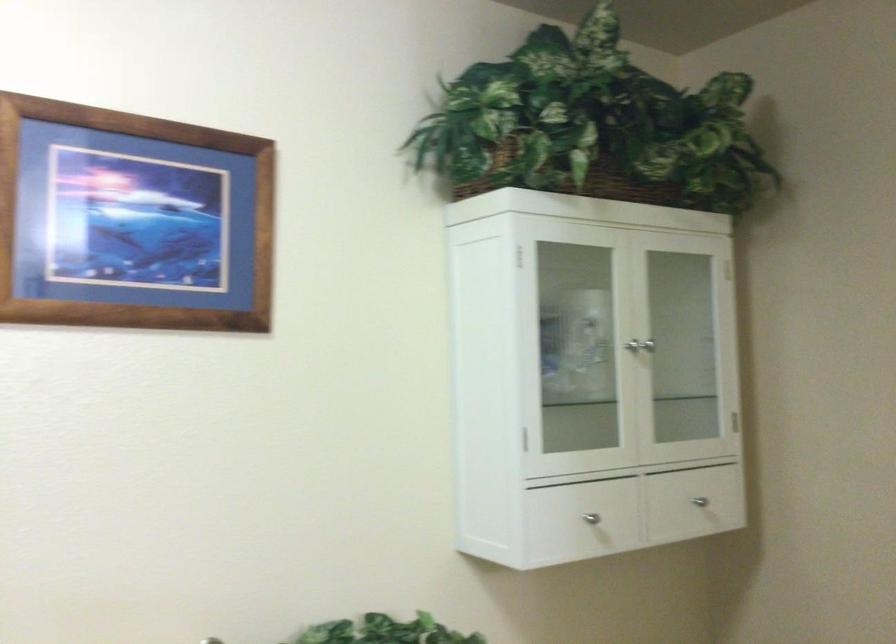
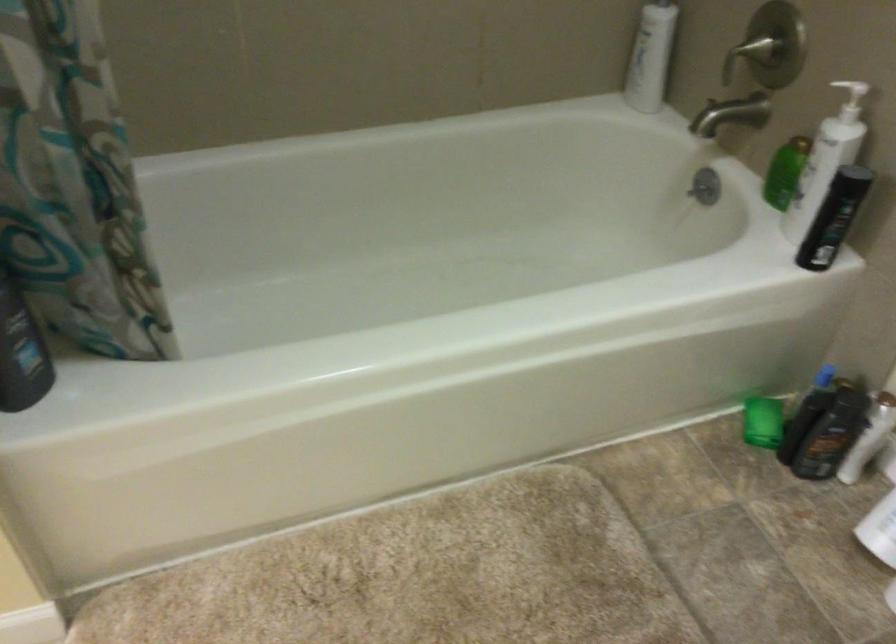
The first image is from the beginning of the video and the second image is from the end. How did the camera likely rotate when shooting the video?

The camera rotated toward left-down.